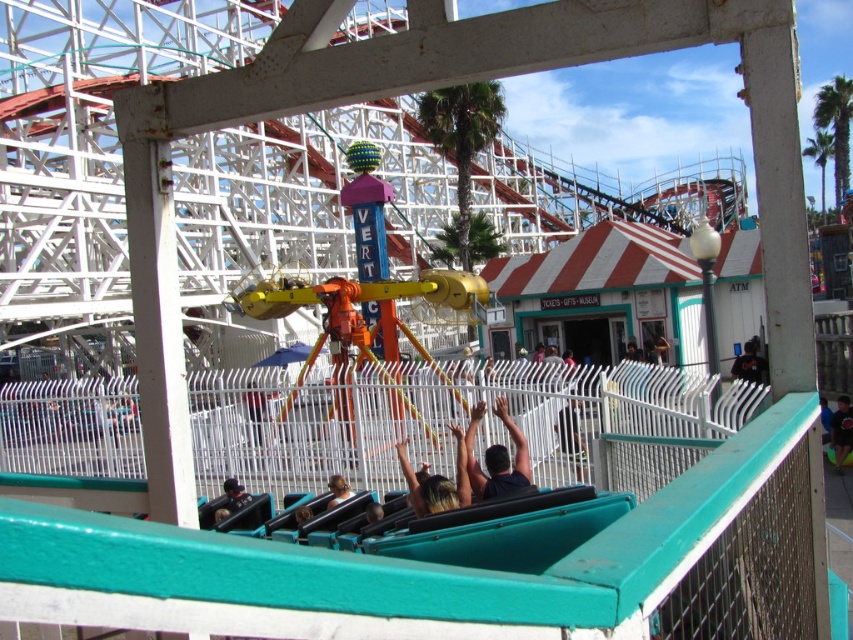
You are observing a group of people at the theme park. You notice a person with blonde hair at center and a person wearing a light brown leather jacket at lower center. Which of these two individuals is taller?

The blonde hair at center is taller than the light brown leather jacket at lower center.

You are standing at the roller coaster safety railings and want to look at two points in the scene. The first point is at coordinate point(450, 488) and the second is at point(834, 458). Which point is closer to you?

Point(450, 488) is closer to the viewer than point(834, 458).